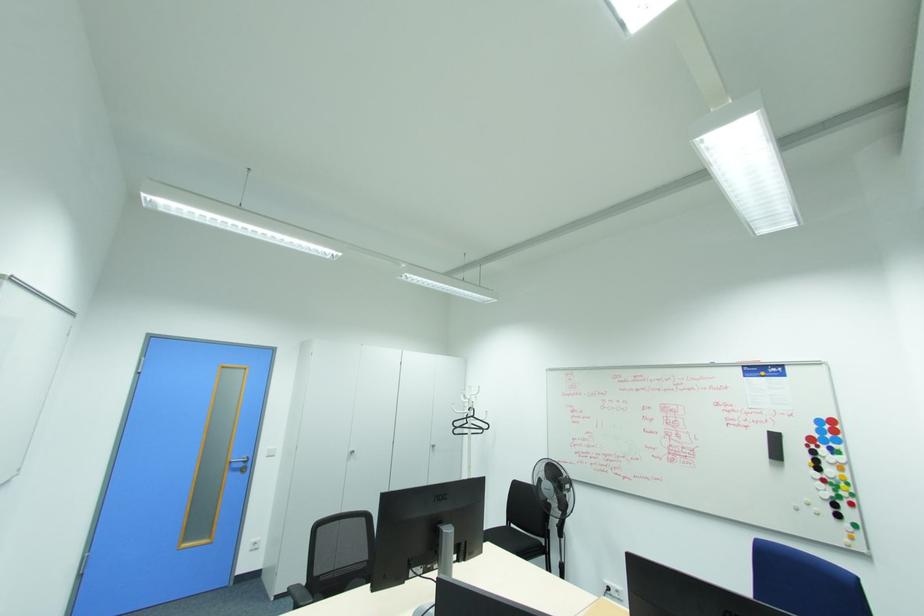
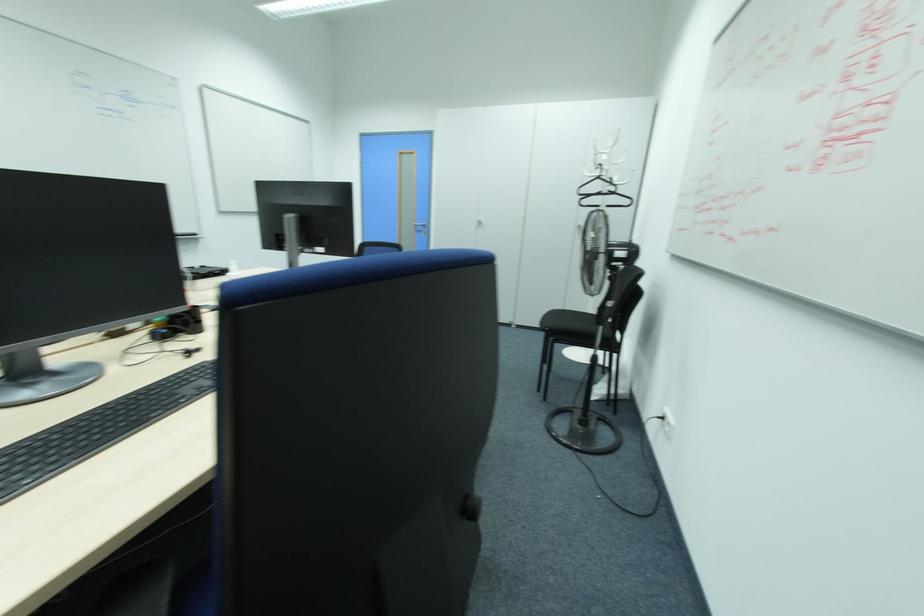
Where in the second image is the point corresponding to (473,416) from the first image?

(599, 177)